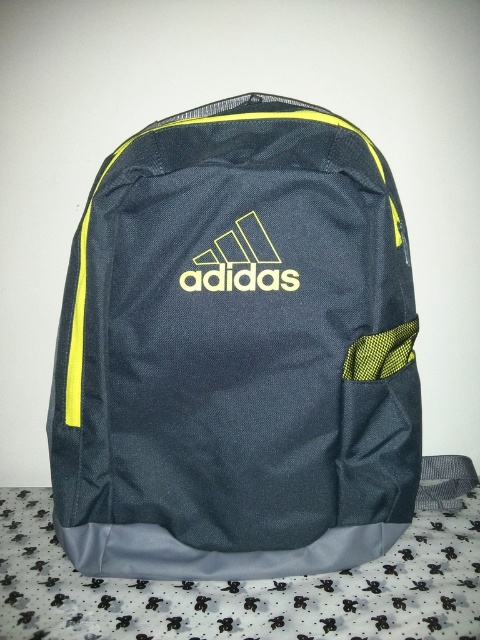
Can you confirm if dark gray fabric backpack at center is positioned above yellow matte logo at center?

No.

Between dark gray fabric backpack at center and yellow matte logo at center, which one has less height?

yellow matte logo at center

Does point (393, 424) lie behind point (239, 227)?

Yes, point (393, 424) is farther from viewer.

Identify the location of dark gray fabric backpack at center. The height and width of the screenshot is (640, 480). (237, 355).